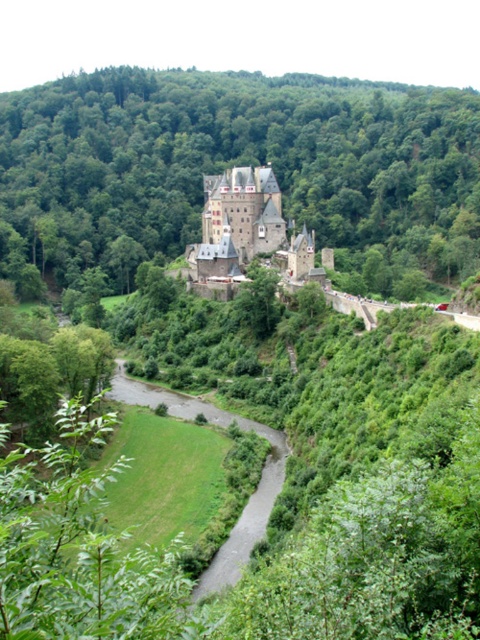
Question: Which of the following is the closest to the observer?

Choices:
 (A) stone medieval castle at center
 (B) green leafy tree at center

Answer: (A)

Question: From the image, what is the correct spatial relationship of green leafy tree at center in relation to stone medieval castle at center?

Choices:
 (A) below
 (B) above

Answer: (B)

Question: Where is green leafy tree at center located in relation to stone medieval castle at center in the image?

Choices:
 (A) left
 (B) right

Answer: (B)

Question: Which of the following is the farthest from the observer?

Choices:
 (A) green leafy tree at center
 (B) stone medieval castle at center

Answer: (A)

Question: Is green leafy tree at center further to the viewer compared to stone medieval castle at center?

Choices:
 (A) yes
 (B) no

Answer: (A)